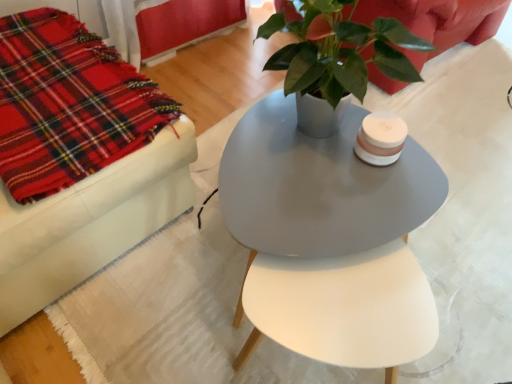
Question: Can matte red couch at upper left be found inside matte gray table at center?

Choices:
 (A) yes
 (B) no

Answer: (B)

Question: Does matte gray table at center turn towards matte red couch at upper left?

Choices:
 (A) yes
 (B) no

Answer: (A)

Question: From the image's perspective, does matte gray table at center appear higher than matte red couch at upper left?

Choices:
 (A) no
 (B) yes

Answer: (A)

Question: Is matte gray table at center at the right side of matte red couch at upper left?

Choices:
 (A) yes
 (B) no

Answer: (B)

Question: Is the depth of matte gray table at center greater than that of matte red couch at upper left?

Choices:
 (A) yes
 (B) no

Answer: (B)

Question: Choose the correct answer: Is matte red couch at upper left inside red plaid fabric at left or outside it?

Choices:
 (A) outside
 (B) inside

Answer: (A)

Question: In the image, is matte red couch at upper left on the left side or the right side of red plaid fabric at left?

Choices:
 (A) right
 (B) left

Answer: (A)

Question: Considering the positions of matte red couch at upper left and red plaid fabric at left in the image, is matte red couch at upper left taller or shorter than red plaid fabric at left?

Choices:
 (A) tall
 (B) short

Answer: (A)

Question: Considering the positions of point (452, 11) and point (61, 21), is point (452, 11) closer or farther from the camera than point (61, 21)?

Choices:
 (A) farther
 (B) closer

Answer: (A)

Question: Looking at the image, does matte gray table at center seem bigger or smaller compared to red plaid fabric at left?

Choices:
 (A) small
 (B) big

Answer: (B)

Question: Which is correct: matte gray table at center is inside red plaid fabric at left, or outside of it?

Choices:
 (A) outside
 (B) inside

Answer: (A)

Question: From their relative heights in the image, would you say matte gray table at center is taller or shorter than red plaid fabric at left?

Choices:
 (A) tall
 (B) short

Answer: (A)

Question: From the image's perspective, is matte gray table at center located above or below red plaid fabric at left?

Choices:
 (A) above
 (B) below

Answer: (B)

Question: Based on their sizes in the image, would you say red plaid fabric at left is bigger or smaller than matte gray table at center?

Choices:
 (A) small
 (B) big

Answer: (A)

Question: From the image's perspective, is red plaid fabric at left above or below matte gray table at center?

Choices:
 (A) below
 (B) above

Answer: (B)